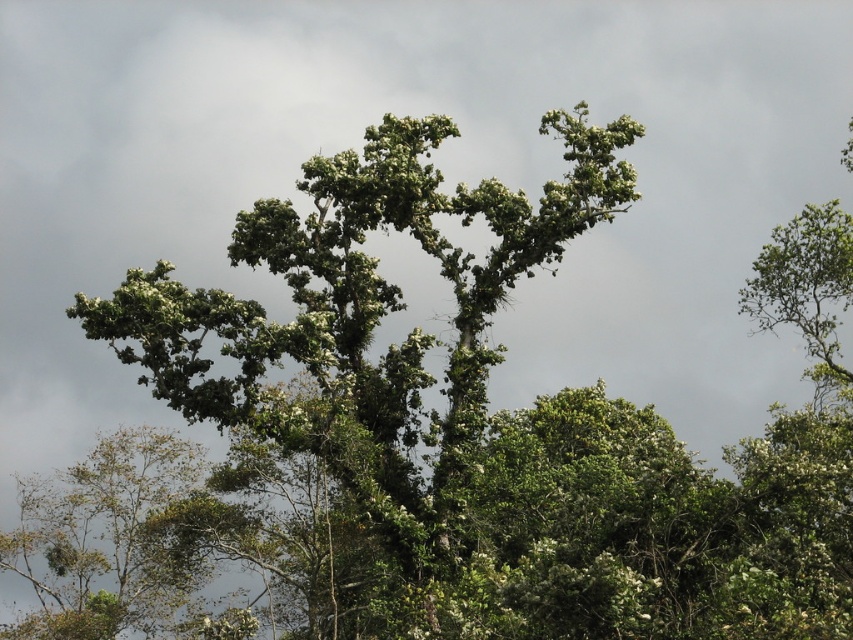
Question: Is green leafy tree at center to the right of green leafy tree at upper center from the viewer's perspective?

Choices:
 (A) yes
 (B) no

Answer: (B)

Question: Where is green leafy tree at center located in relation to green leafy tree at upper center in the image?

Choices:
 (A) left
 (B) right

Answer: (A)

Question: From the image, what is the correct spatial relationship of green leafy tree at center in relation to green leafy tree at upper center?

Choices:
 (A) below
 (B) above

Answer: (A)

Question: Which object is closer to the camera taking this photo?

Choices:
 (A) green leafy tree at upper center
 (B) green leafy tree at center

Answer: (B)

Question: Which object is farther from the camera taking this photo?

Choices:
 (A) green leafy tree at upper center
 (B) green leafy tree at center

Answer: (A)